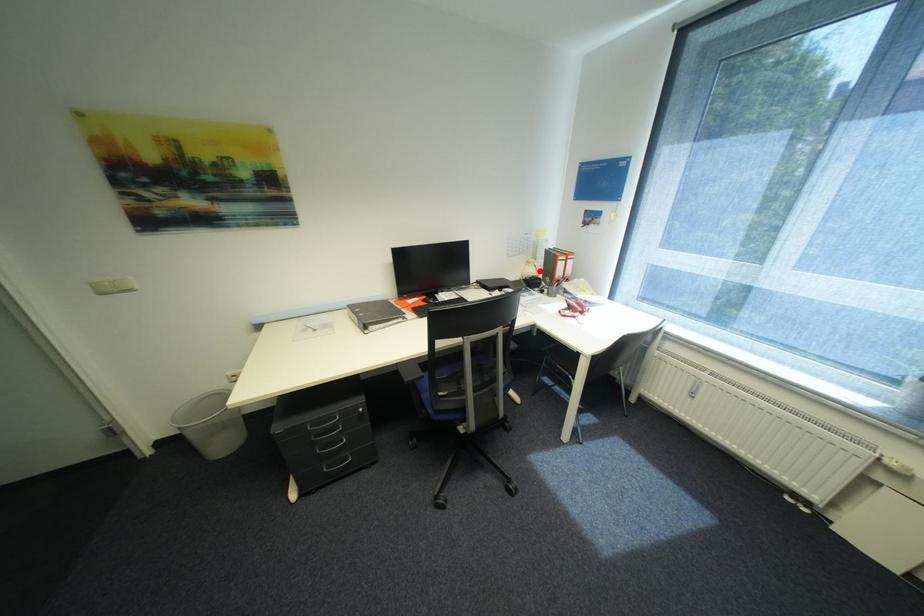
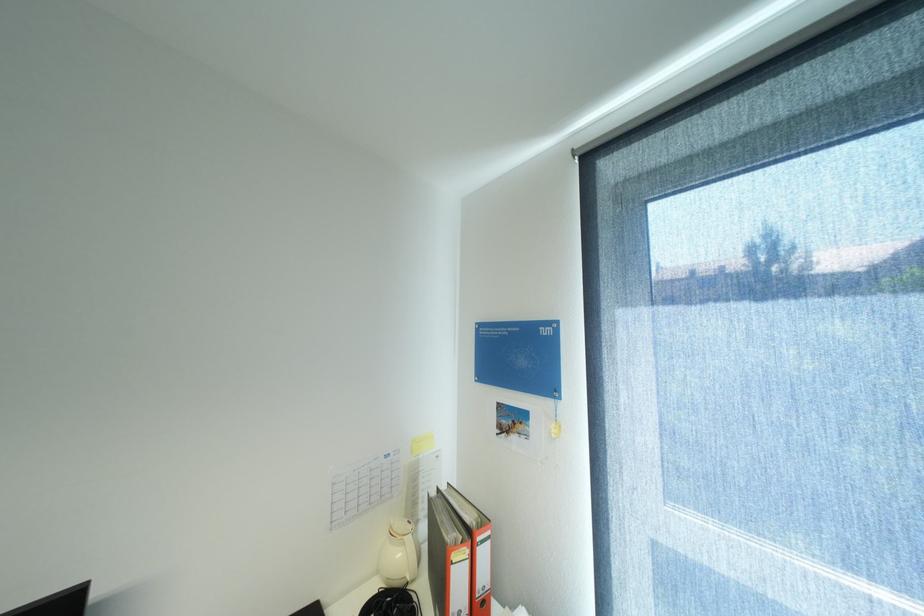
Question: I am providing you with two images of the same scene from different viewpoints. In image1, a red point is highlighted. Considering the same 3D point in image2, which of the following is correct?

Choices:
 (A) It is closer
 (B) It is farther

Answer: (B)